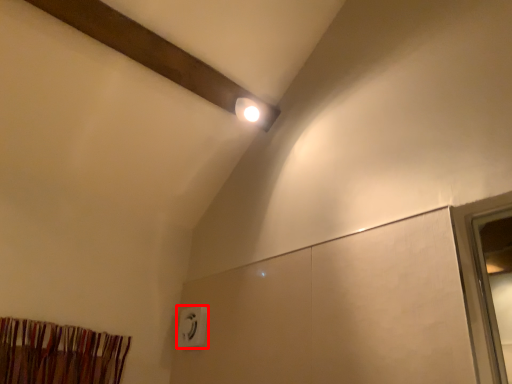
Question: From the image's perspective, considering the relative positions of electric outlet (annotated by the red box) and curtain in the image provided, where is electric outlet (annotated by the red box) located with respect to the staircase?

Choices:
 (A) above
 (B) below

Answer: (B)